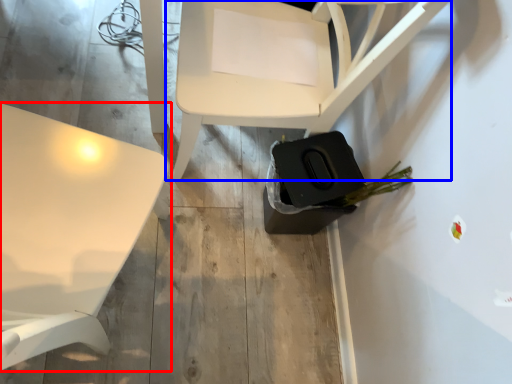
Question: Which point is closer to the camera, table (highlighted by a red box) or chair (highlighted by a blue box)?

Choices:
 (A) table
 (B) chair

Answer: (A)